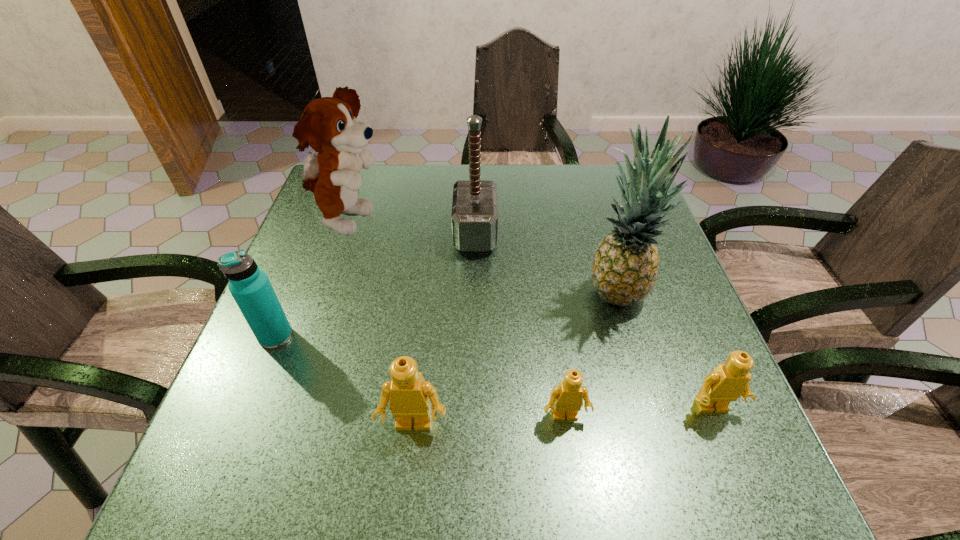
Please point a free position for a Lego on the left. Please provide its 2D coordinates. Your answer should be formatted as a tuple, i.e. [(x, y)], where the tuple contains the x and y coordinates of a point satisfying the conditions above.

[(258, 434)]